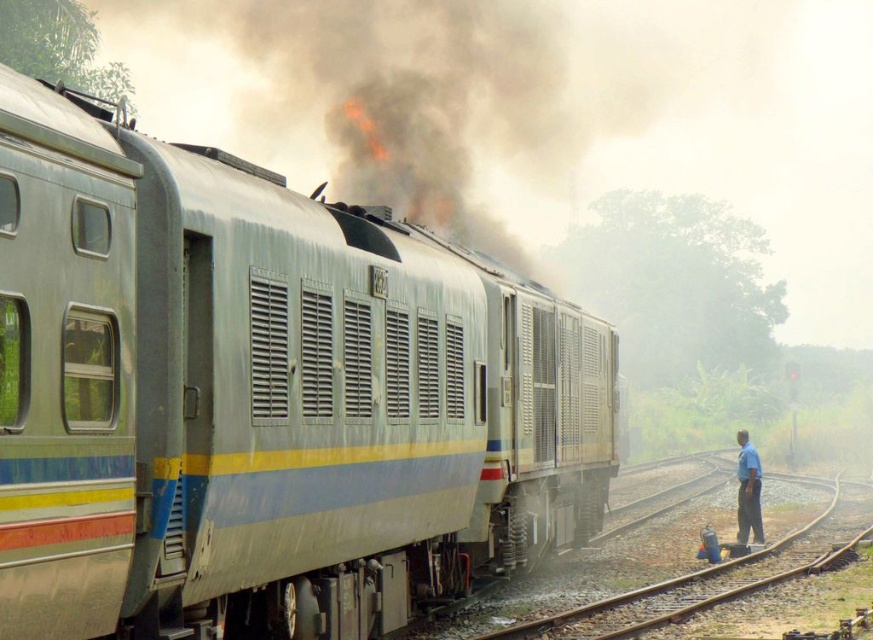
You are a photographer trying to capture the scene of the metallic train at left and the blue shirt at right. Which object should you zoom in on to ensure both fit in the frame without cropping?

The metallic train at left is wider than the blue shirt at right, so you should zoom in on the metallic train at left to ensure both fit in the frame without cropping.

Looking at this image, you are a photographer trying to capture the metallic train at left and the blue shirt at right in a single frame. Based on their heights, which object should you focus on first to ensure both are in the frame?

The metallic train at left is taller than the blue shirt at right, so you should focus on the metallic train at left first to ensure both are in the frame.

You are a photographer standing in the middle of the scene. You want to capture a photo where the metallic train at left is clearly visible in the foreground while also including the blue shirt at right in the background. Is this possible?

Yes, because the metallic train at left is in front of the blue shirt at right, so positioning yourself so the train is closer to the camera while the blue shirt at right remains visible behind it would achieve the desired composition.